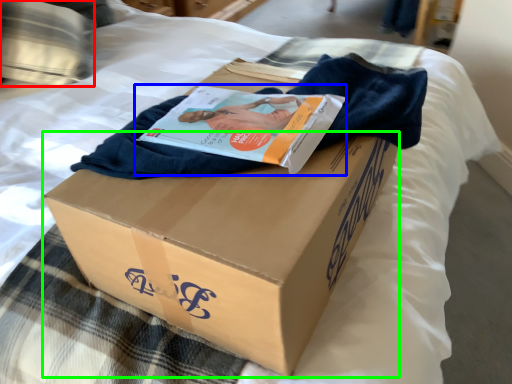
Question: Which object is positioned closest to pillow (highlighted by a red box)? Select from magazine (highlighted by a blue box) and cardboard box (highlighted by a green box).

Choices:
 (A) magazine
 (B) cardboard box

Answer: (A)